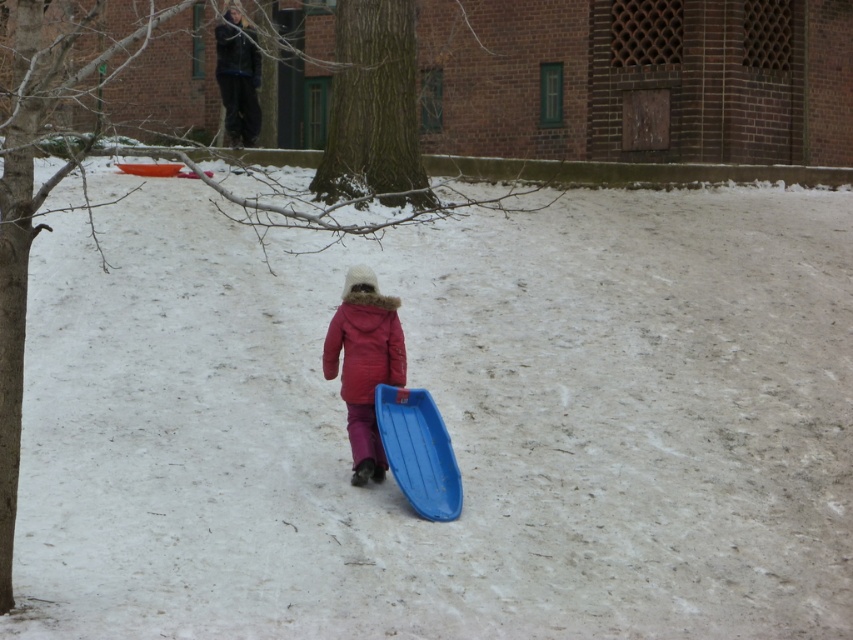
You are standing at the camera position and want to reach the point marked at coordinates (x=376, y=356). If you walk straight ahead, how far will you have to walk to reach that point?

The point marked at coordinates (x=376, y=356) is 38.05 feet away from the camera, so you will have to walk 38.05 feet straight ahead to reach it.

You are a photographer trying to capture the scene with the matte pink coat at center and the blue plastic sled at center. Which object should you focus on first if you want to ensure both are in sharp focus?

The matte pink coat at center is located above the blue plastic sled at center, so focusing on the matte pink coat at center first will help ensure both are in sharp focus since it is closer to the camera.

You are a photographer trying to capture a photo of the matte pink coat at center and the blue plastic sled at center in the snowy scene. If you want to ensure both objects are fully visible in the frame without any part being cut off, which object should you adjust your camera angle to focus on first?

The blue plastic sled at center is wider than the matte pink coat at center, so you should focus on ensuring the blue plastic sled at center fits in the frame first to accommodate its larger size.